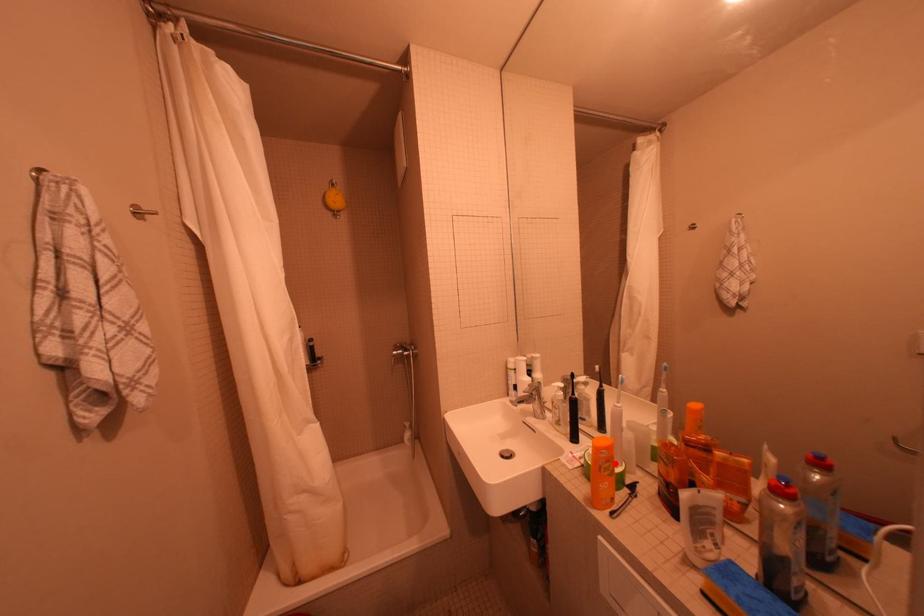
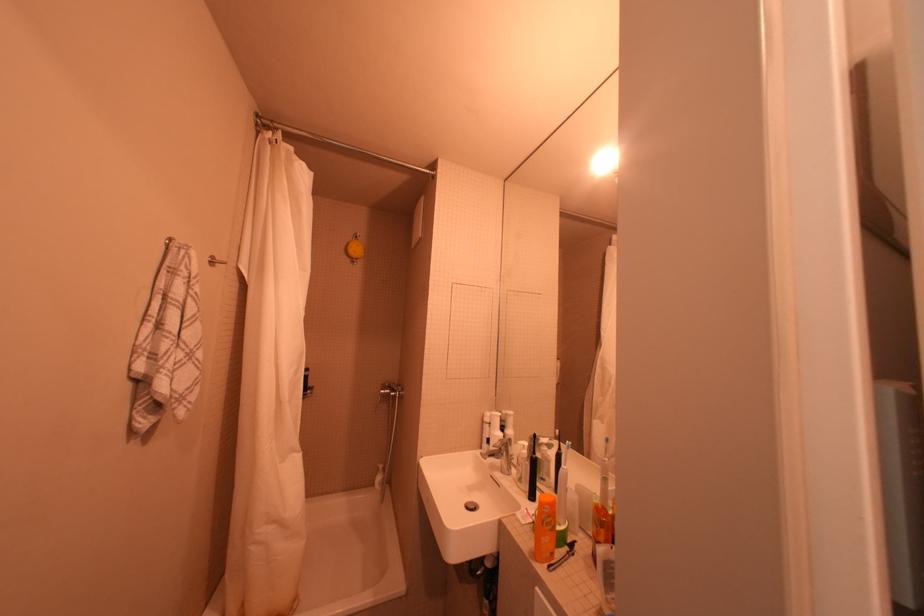
Where in the second image is the point corresponding to the highlighted location from the first image?

(556, 517)